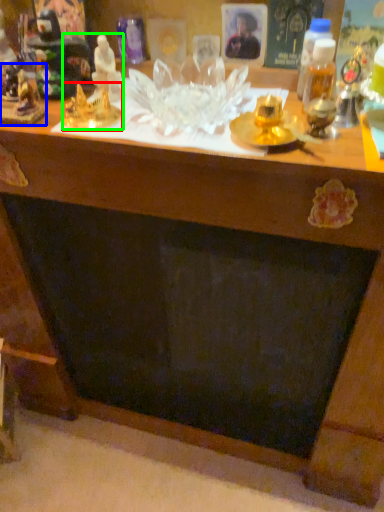
Question: Which is farther away from toy (highlighted by a red box)? toy (highlighted by a blue box) or toy (highlighted by a green box)?

Choices:
 (A) toy
 (B) toy

Answer: (A)